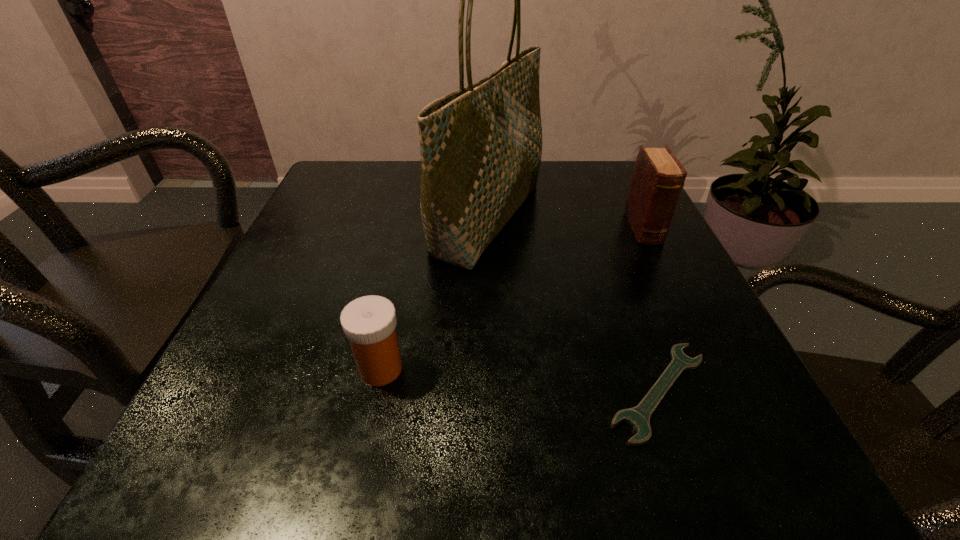
The height and width of the screenshot is (540, 960). Find the location of `the tallest object`. the tallest object is located at coordinates (481, 146).

The height and width of the screenshot is (540, 960). What are the coordinates of `the third object from right to left` in the screenshot? It's located at (481, 146).

Where is `the second tallest object`? Image resolution: width=960 pixels, height=540 pixels. the second tallest object is located at coordinates (658, 177).

I want to click on the leftmost object, so click(x=369, y=322).

Locate an element on the screen. This screenshot has width=960, height=540. medicine is located at coordinates (369, 322).

The image size is (960, 540). Identify the location of wrench. (638, 417).

Find the location of a particular element. vacant space situated 0.210m on the left of the shopping bag is located at coordinates (332, 218).

Where is `blank area located on the spine side of the diary`? The image size is (960, 540). blank area located on the spine side of the diary is located at coordinates (684, 310).

The height and width of the screenshot is (540, 960). Find the location of `free region located on the left of the third tallest object`. free region located on the left of the third tallest object is located at coordinates (300, 368).

At what (x,y) coordinates should I click in order to perform the action: click on vacant space located 0.290m on the left of the shortest object. Please return your answer as a coordinate pair (x, y). Image resolution: width=960 pixels, height=540 pixels. Looking at the image, I should click on (389, 392).